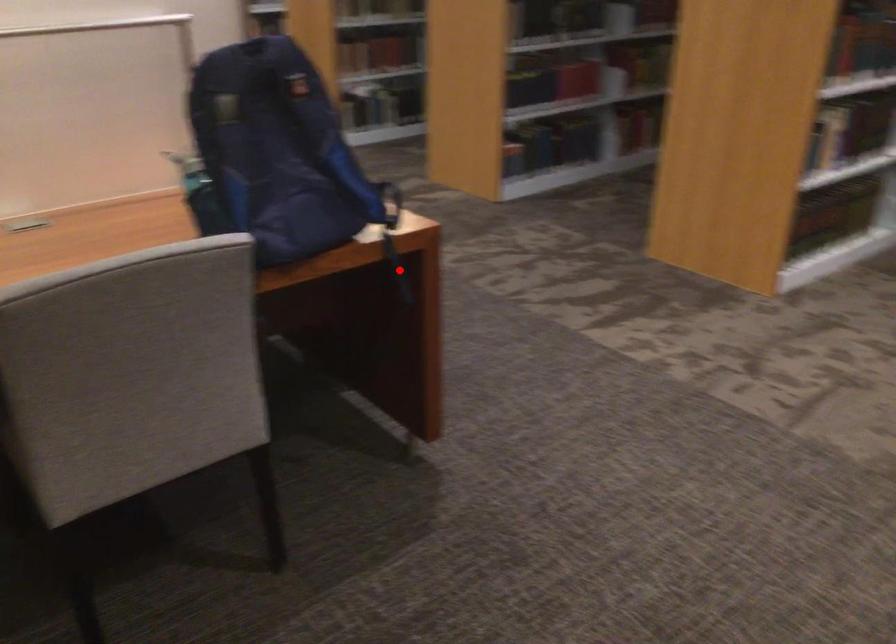
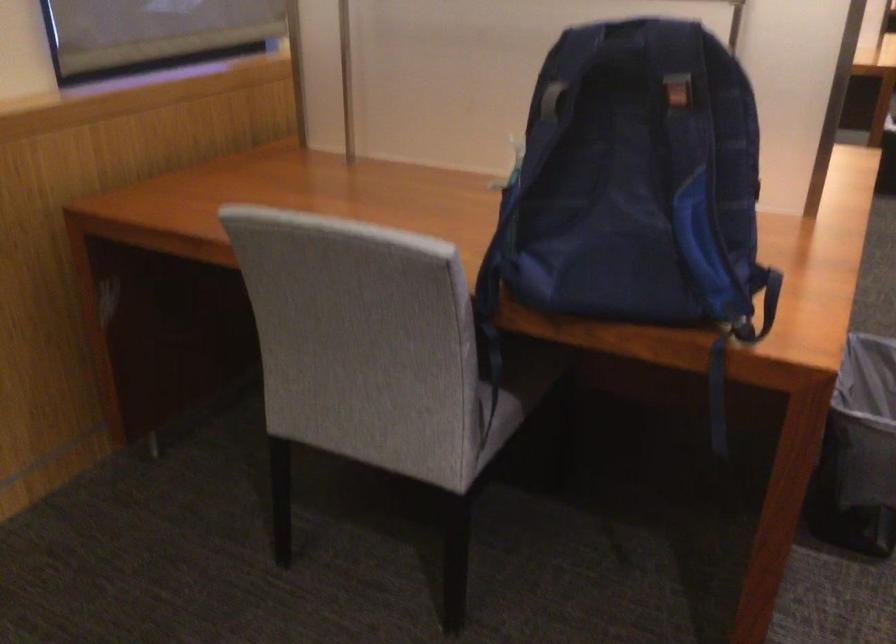
Question: I am providing you with two images of the same scene from different viewpoints. A red point is marked on the first image. At the location where the point appears in image 1, is it still visible in image 2?

Choices:
 (A) Yes
 (B) No

Answer: (A)